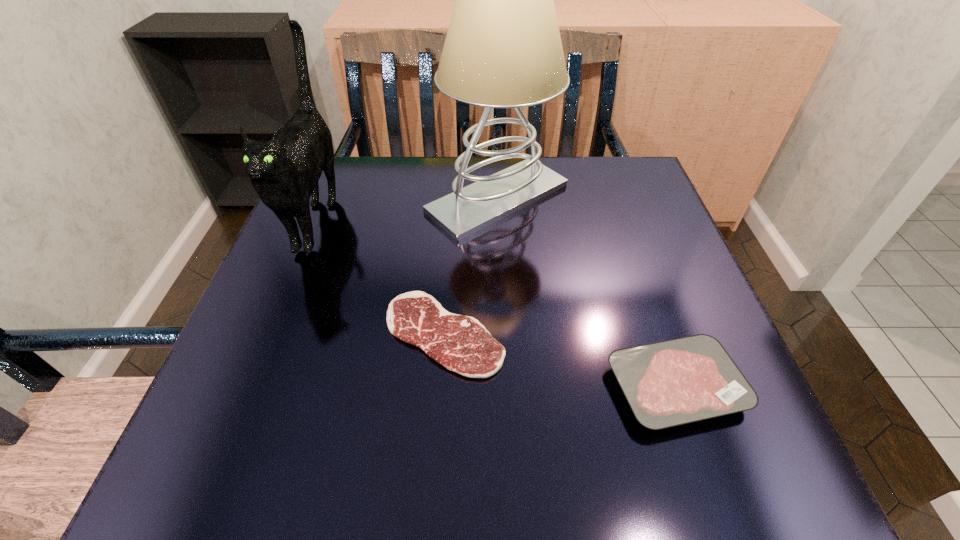
Image resolution: width=960 pixels, height=540 pixels. I want to click on blank area at the left edge, so click(x=292, y=394).

In the image, there is a desktop. Where is `vacant space at the far left corner`? The width and height of the screenshot is (960, 540). vacant space at the far left corner is located at coordinates (344, 161).

In the image, there is a desktop. At what (x,y) coordinates should I click in order to perform the action: click on vacant region at the near left corner. Please return your answer as a coordinate pair (x, y). The height and width of the screenshot is (540, 960). Looking at the image, I should click on click(259, 462).

In the image, there is a desktop. Find the location of `free space at the far right corner`. free space at the far right corner is located at coordinates (649, 200).

The width and height of the screenshot is (960, 540). I want to click on vacant space at the near right corner of the desktop, so point(759,483).

The height and width of the screenshot is (540, 960). Find the location of `free area in between the shortest object and the taller steak`. free area in between the shortest object and the taller steak is located at coordinates (560, 360).

Where is `free space between the shortest object and the cat`? free space between the shortest object and the cat is located at coordinates (381, 276).

Identify the location of free area in between the table lamp and the right steak. (587, 292).

Locate an element on the screen. This screenshot has height=540, width=960. vacant area that lies between the left steak and the cat is located at coordinates (381, 276).

Identify the location of empty space that is in between the taller steak and the tallest object. The height and width of the screenshot is (540, 960). coord(587,292).